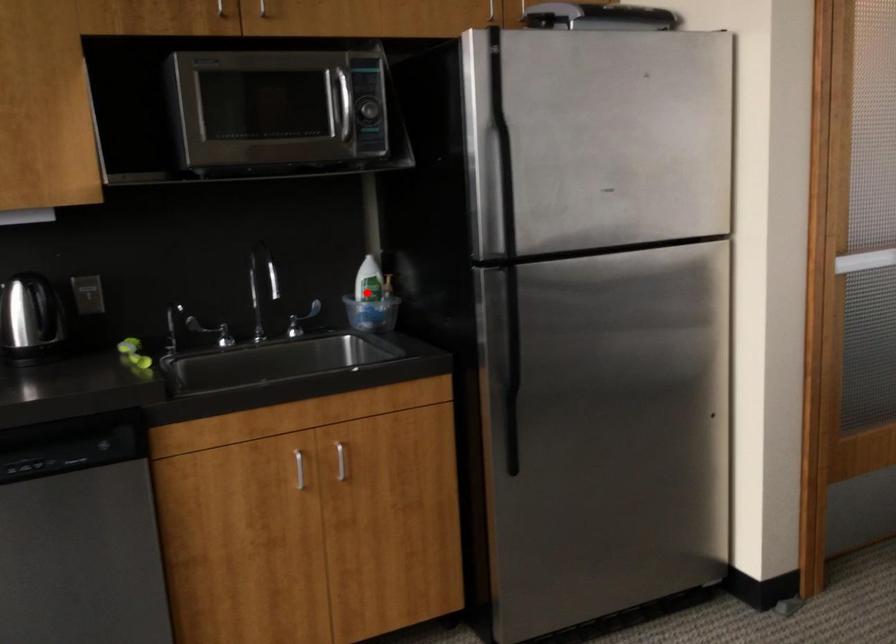
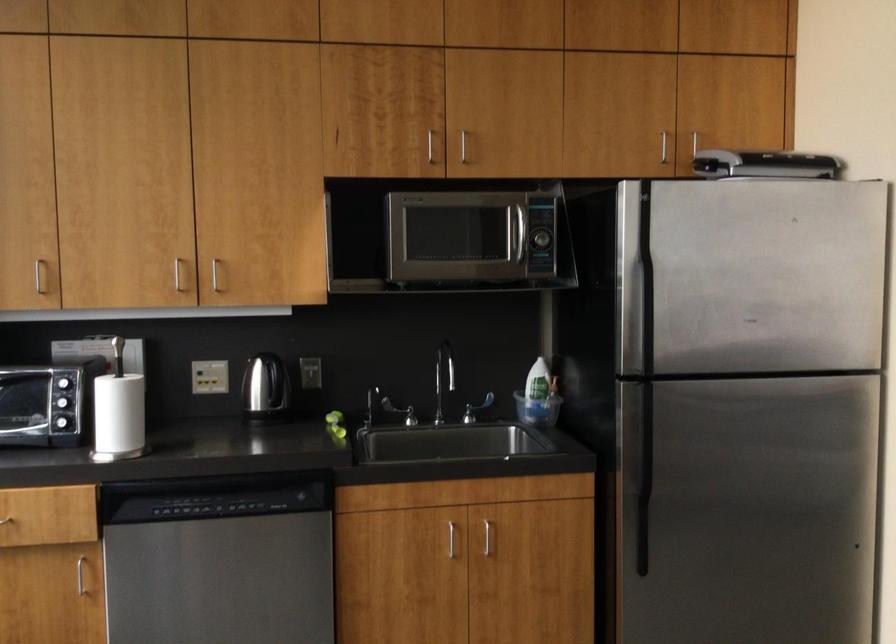
Question: I am providing you with two images of the same scene from different viewpoints. Given a red point in image1, look at the same physical point in image2. Is it:

Choices:
 (A) Closer to the viewpoint
 (B) Farther from the viewpoint

Answer: (B)